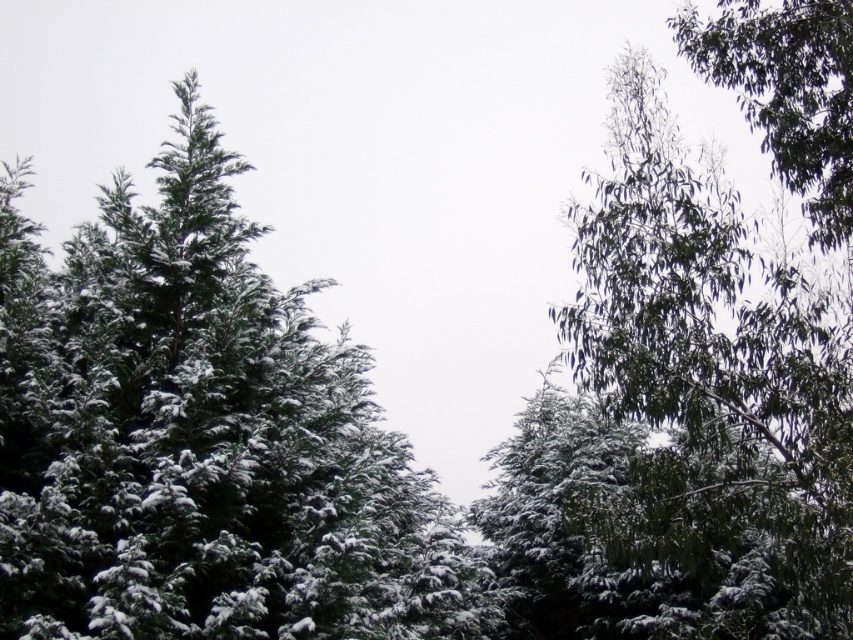
Question: Where is snow-covered evergreen at center located in relation to green leafy tree at upper right in the image?

Choices:
 (A) left
 (B) right

Answer: (A)

Question: Which point is farther from the camera taking this photo?

Choices:
 (A) (793, 180)
 (B) (39, 387)

Answer: (A)

Question: Which point is farther to the camera?

Choices:
 (A) green leafy tree at upper right
 (B) snow-covered evergreen at center

Answer: (A)

Question: Can you confirm if snow-covered evergreen at center is positioned above green leafy tree at upper right?

Choices:
 (A) yes
 (B) no

Answer: (B)

Question: Does snow-covered evergreen at center appear on the right side of green leafy tree at upper right?

Choices:
 (A) yes
 (B) no

Answer: (B)